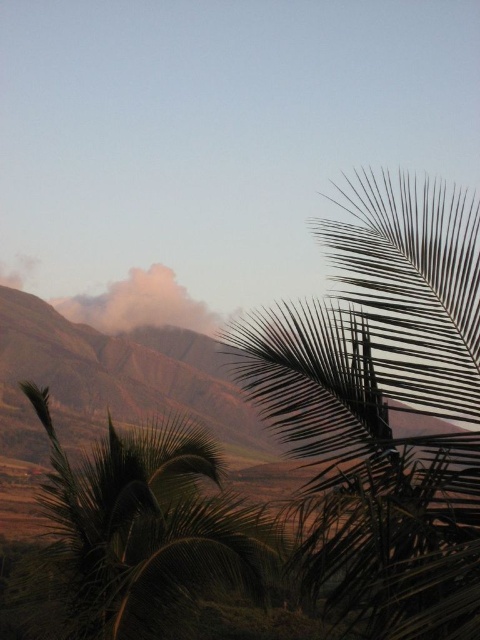
You are an artist sketching this landscape and want to ensure the palm trees are proportionally accurate. Which palm tree, the dark green leafy palm at right or the green leafy palm at lower left, should you draw shorter in your sketch?

The dark green leafy palm at right should be drawn shorter as it has a lesser height compared to the green leafy palm at lower left.

You are standing in a tropical garden and see the dark green leafy palm at right and the green leafy palm at lower left. Which palm is located more to the right side?

The dark green leafy palm at right is more to the right side than the green leafy palm at lower left.